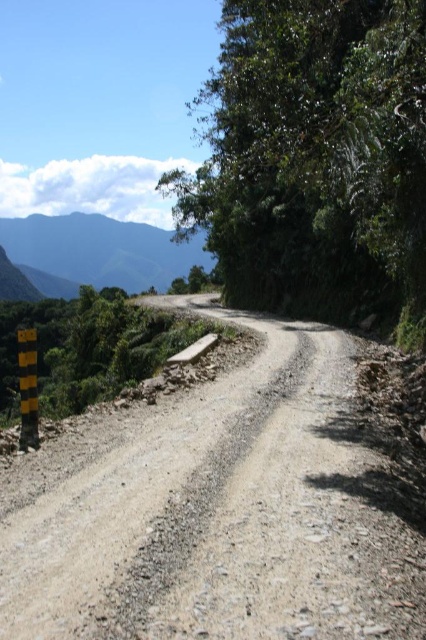
You are a hiker standing on the gray gravel road at center and want to take a photo of the green textured mountain at upper left. Which direction should you face to ensure the mountain is in the background of your photo?

You should face away from the green textured mountain at upper left. Since the gray gravel road at center is closer to the viewer than the mountain, facing away from the mountain will place it behind you in the background of your photo.

Looking at this image, you are standing at the camera position and want to walk to point (282, 51). The road is 15 meters long. Can you reach the point before the road ends?

The distance between you and point (282, 51) is 14.74 meters, which is less than the road length of 15 meters. Therefore, you can reach the point before the road ends.

From the picture: You are a hiker planning to take a photo of both the green leafy tree at upper right and the green textured mountain at upper left. Based on their sizes in the scene, which object should you focus on first to ensure both are in frame?

The green leafy tree at upper right is narrower than the green textured mountain at upper left, so you should focus on framing the wider green textured mountain at upper left first to ensure both fit in the photo.